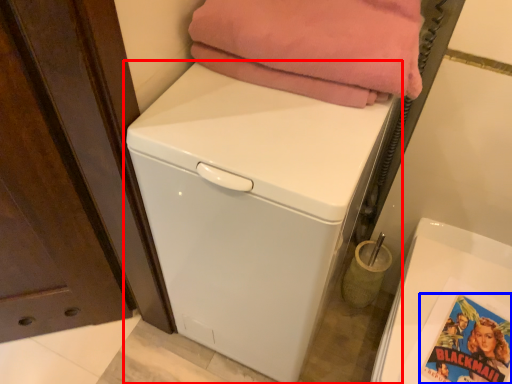
Question: Among these objects, which one is nearest to the camera, washing machine (highlighted by a red box) or comic book (highlighted by a blue box)?

Choices:
 (A) washing machine
 (B) comic book

Answer: (A)